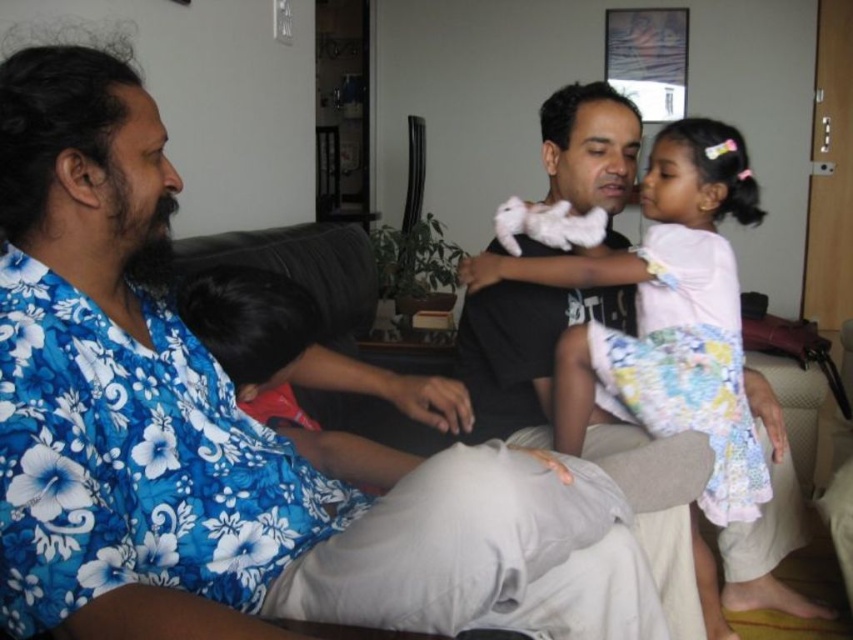
Question: Can you confirm if white cotton dress at center is positioned below black fabric at left?

Choices:
 (A) no
 (B) yes

Answer: (B)

Question: Among these points, which one is farthest from the camera?

Choices:
 (A) (700, 260)
 (B) (256, 301)

Answer: (A)

Question: Which point is closer to the camera?

Choices:
 (A) (227, 332)
 (B) (733, 419)

Answer: (A)

Question: Can you confirm if white cotton dress at center is positioned to the right of black fabric at left?

Choices:
 (A) no
 (B) yes

Answer: (B)

Question: Does white cotton dress at center have a larger size compared to black fabric at left?

Choices:
 (A) no
 (B) yes

Answer: (B)